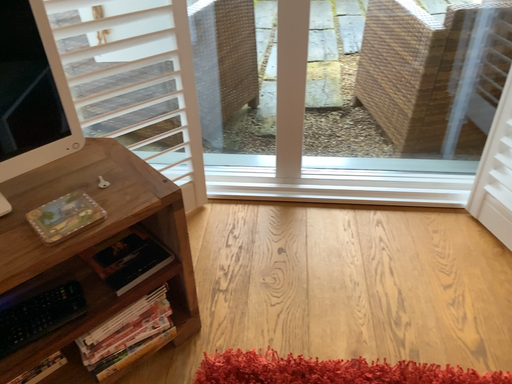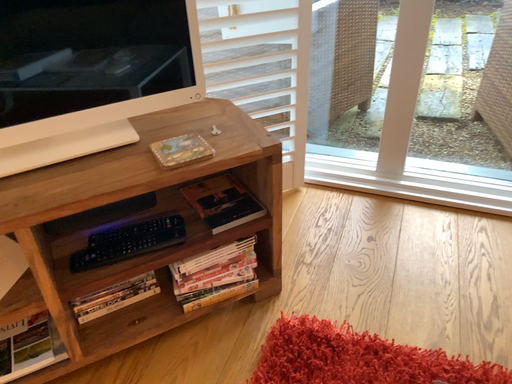
Question: Which way did the camera rotate in the video?

Choices:
 (A) rotated right
 (B) rotated left

Answer: (B)